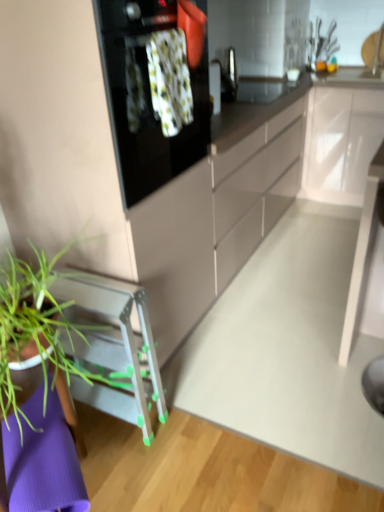
Where is `vacant space behind white glossy table at center`? vacant space behind white glossy table at center is located at coordinates (310, 327).